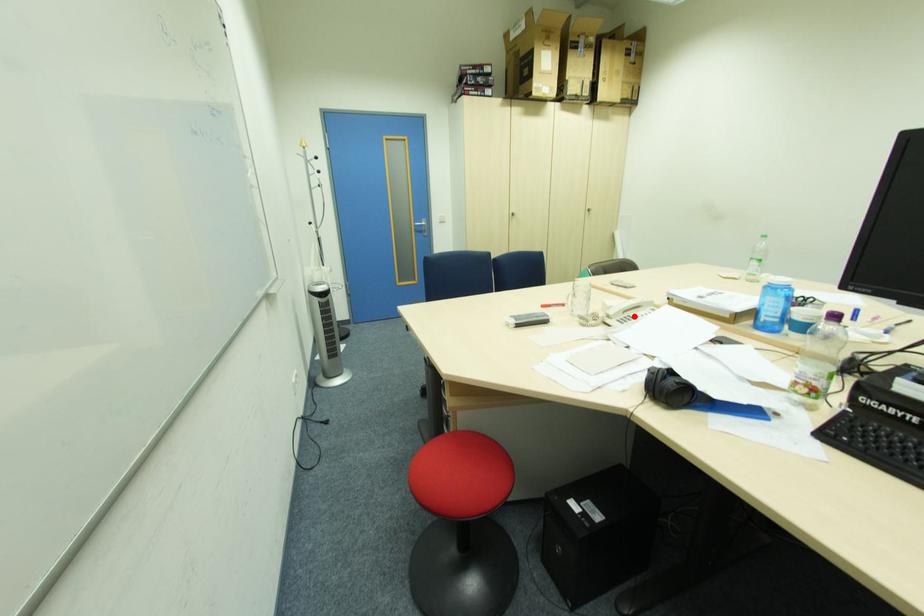
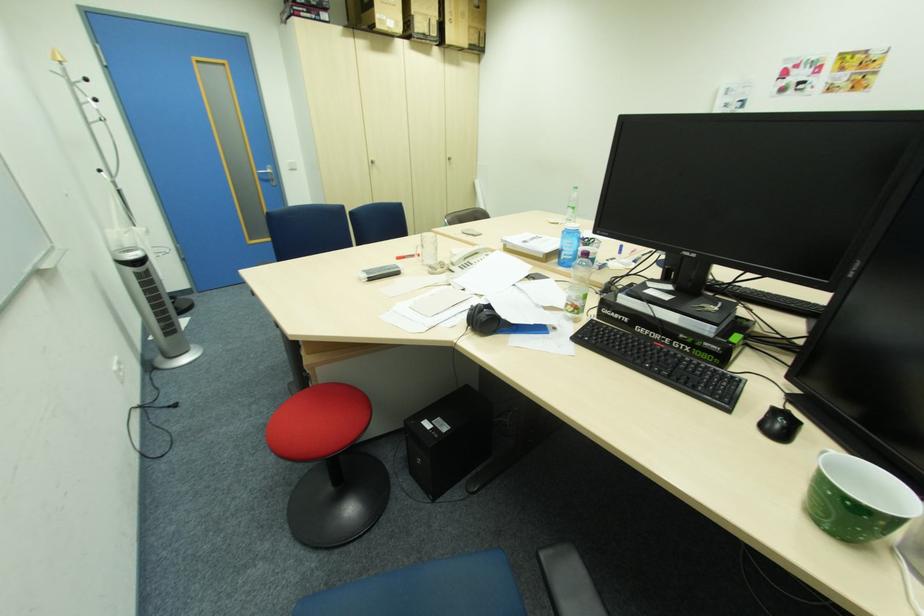
In the second image, find the point that corresponds to the highlighted location in the first image.

(475, 262)